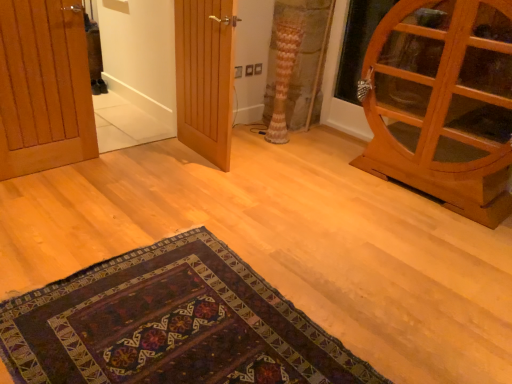
The width and height of the screenshot is (512, 384). I want to click on free point in front of wooden door at left, placed as the third door when sorted from right to left, so click(47, 200).